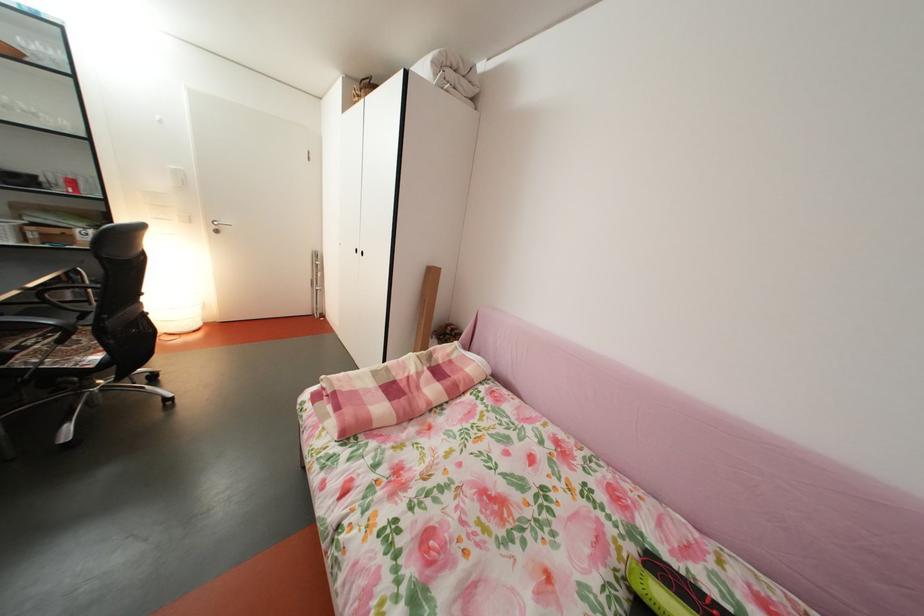
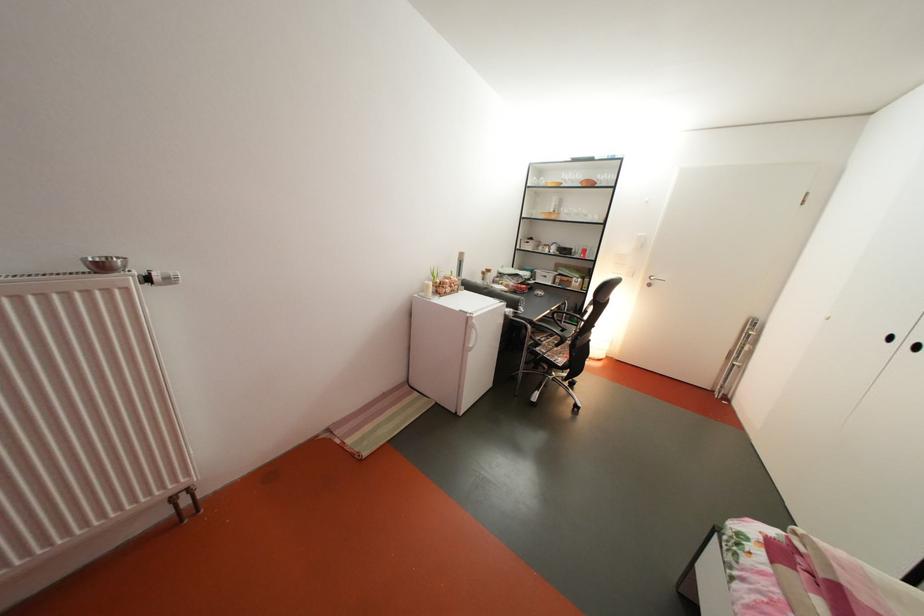
Where in the second image is the point corresponding to (74,188) from the first image?

(591, 257)